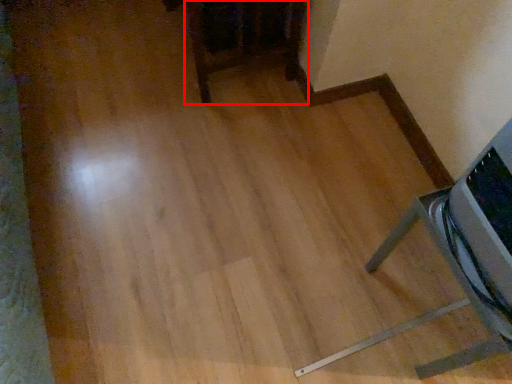
Question: From the image's perspective, considering the relative positions of furniture (annotated by the red box) and furniture in the image provided, where is furniture (annotated by the red box) located with respect to the staircase?

Choices:
 (A) below
 (B) above

Answer: (B)